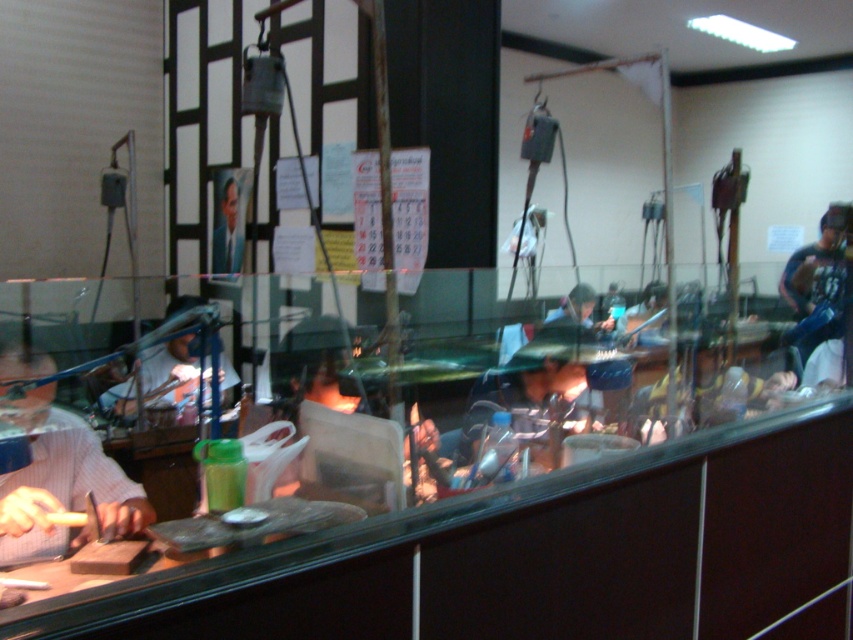
Is white plastic bag at left bigger than smooth skin face at center?

Indeed, white plastic bag at left has a larger size compared to smooth skin face at center.

Consider the image. Can you confirm if white plastic bag at left is smaller than smooth skin face at center?

No.

Locate an element on the screen. white plastic bag at left is located at coordinates (170, 371).

Between matte plastic glasses at left and white plastic bag at left, which one has more height?

matte plastic glasses at left

Describe the element at coordinates (62, 484) in the screenshot. I see `matte plastic glasses at left` at that location.

Image resolution: width=853 pixels, height=640 pixels. In order to click on matte plastic glasses at left in this screenshot , I will do `click(62, 484)`.

Is dark blue jeans at right above white plastic bag at left?

Yes.

The image size is (853, 640). Find the location of `dark blue jeans at right`. dark blue jeans at right is located at coordinates (817, 284).

Does point (807, 298) come in front of point (154, 364)?

No, it is not.

This screenshot has width=853, height=640. Find the location of `dark blue jeans at right`. dark blue jeans at right is located at coordinates (817, 284).